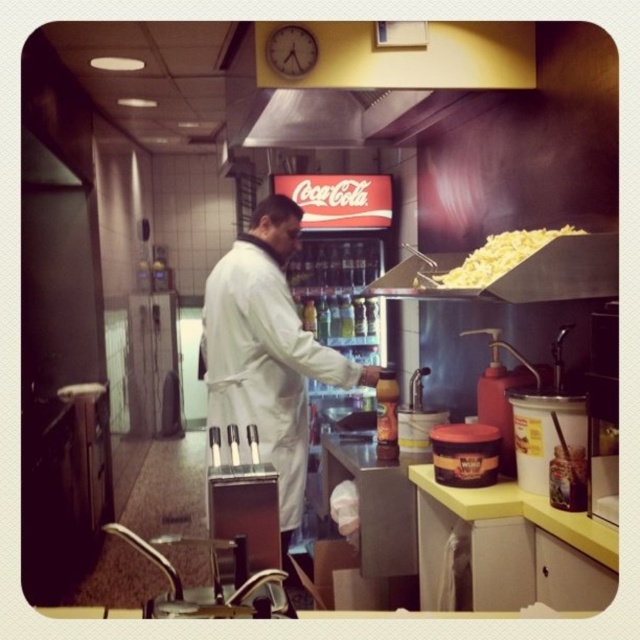
Question: Can you confirm if white matte coat at center is bigger than yellow crumbly cheese at upper right?

Choices:
 (A) yes
 (B) no

Answer: (A)

Question: Can you confirm if white matte coat at center is thinner than yellow crumbly cheese at upper right?

Choices:
 (A) no
 (B) yes

Answer: (A)

Question: Can you confirm if white matte coat at center is smaller than yellow crumbly cheese at upper right?

Choices:
 (A) yes
 (B) no

Answer: (B)

Question: Which point is closer to the camera?

Choices:
 (A) (246, 253)
 (B) (467, 276)

Answer: (B)

Question: Which point appears farthest from the camera in this image?

Choices:
 (A) [x=205, y=307]
 (B) [x=541, y=232]

Answer: (A)

Question: Which object appears farthest from the camera in this image?

Choices:
 (A) white matte coat at center
 (B) yellow crumbly cheese at upper right

Answer: (A)